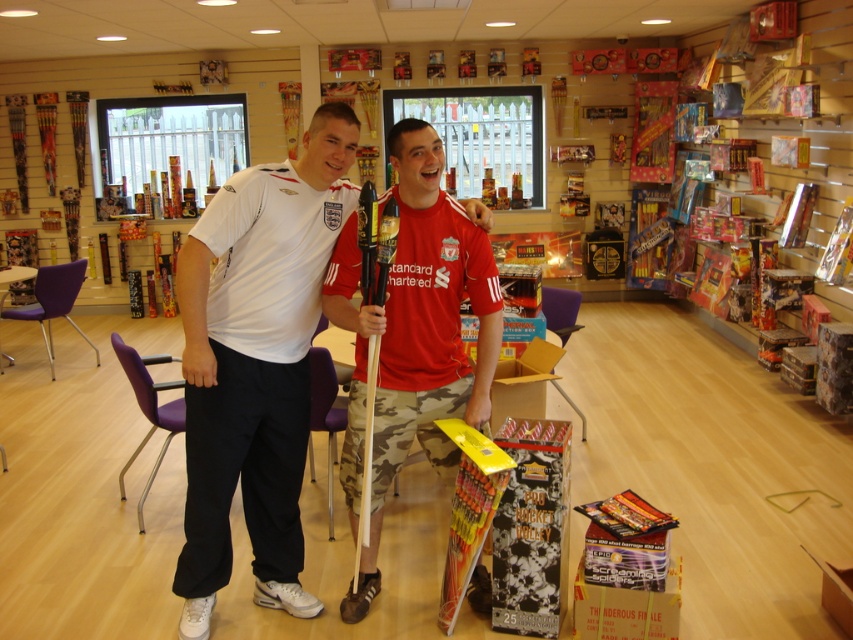
Can you confirm if white matte t-shirt at center is positioned to the left of camouflage shorts at center?

Yes, white matte t-shirt at center is to the left of camouflage shorts at center.

Is white matte t-shirt at center smaller than camouflage shorts at center?

Incorrect, white matte t-shirt at center is not smaller in size than camouflage shorts at center.

I want to click on white matte t-shirt at center, so click(254, 364).